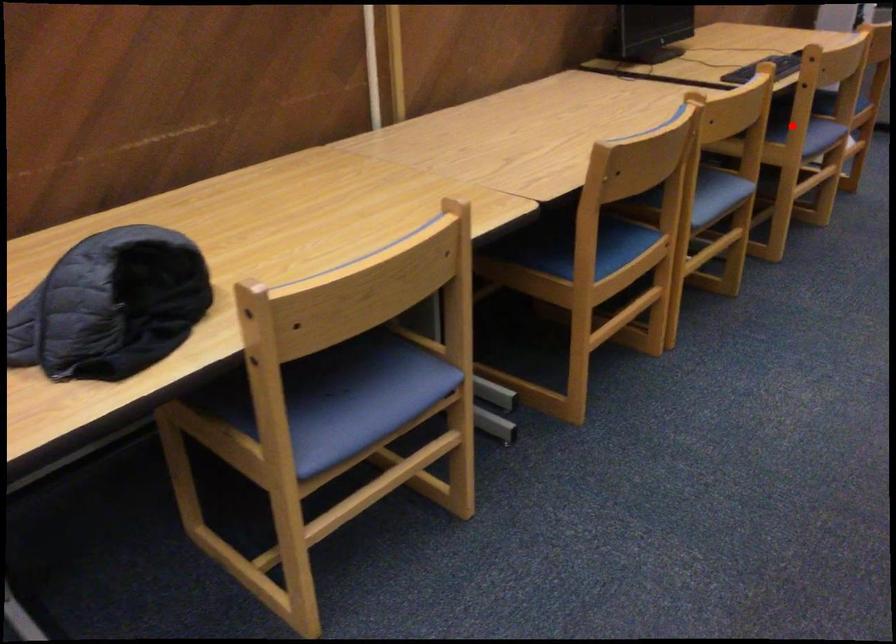
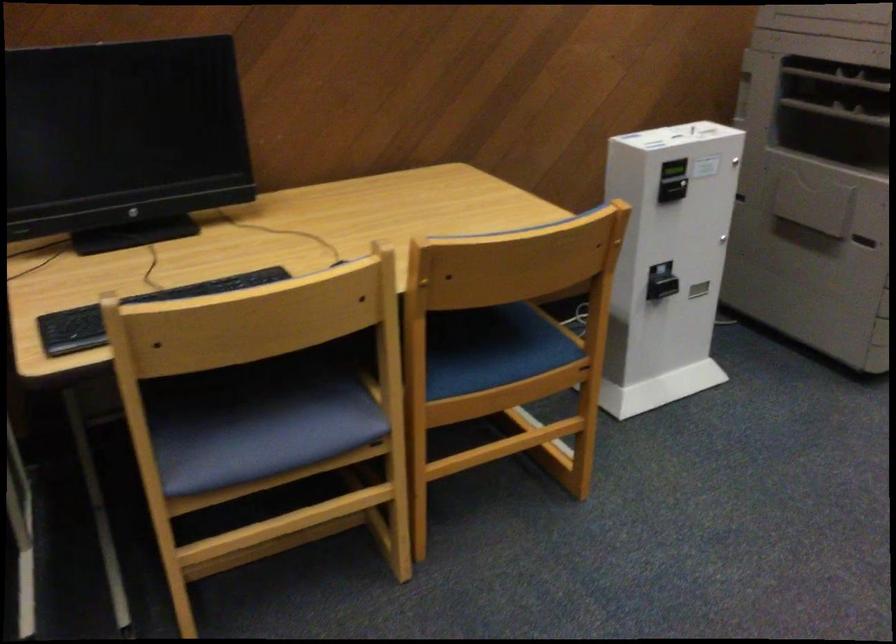
Find the pixel in the second image that matches the highlighted location in the first image.

(255, 422)